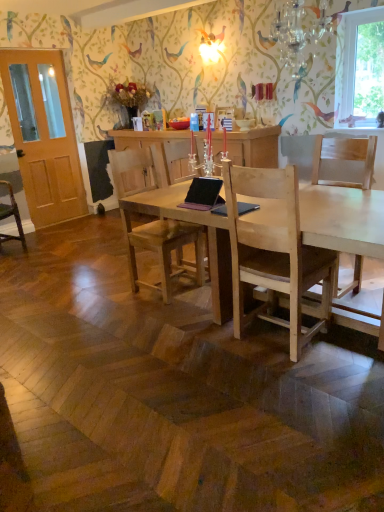
Question: Would you say crystal glass chandelier at upper center is to the left or to the right of natural wood desk at center in the picture?

Choices:
 (A) left
 (B) right

Answer: (B)

Question: Considering the positions of crystal glass chandelier at upper center and natural wood desk at center in the image, is crystal glass chandelier at upper center taller or shorter than natural wood desk at center?

Choices:
 (A) short
 (B) tall

Answer: (A)

Question: Estimate the real-world distances between objects in this image. Which object is farther from the crystal glass chandelier at upper center?

Choices:
 (A) light brown wooden chair at center, which ranks as the second chair in front-to-back order
 (B) light wood chair at center, marked as the first chair in a front-to-back arrangement
 (C) pink leather laptop at center
 (D) clear glass window at upper right
 (E) wooden chair at left, the third chair when ordered from front to back

Answer: (E)

Question: Which object is positioned closest to the crystal glass chandelier at upper center?

Choices:
 (A) pink leather laptop at center
 (B) light brown wooden chair at center, which ranks as the second chair in front-to-back order
 (C) wooden chair at left, the 3th chair when ordered from right to left
 (D) clear glass window at upper right
 (E) light brown wooden door at left

Answer: (D)